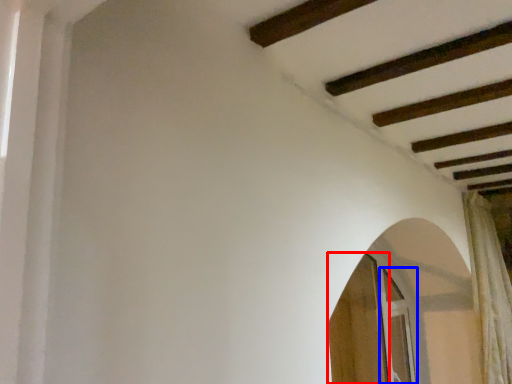
Question: Which object appears closest to the camera in this image, screen door (highlighted by a red box) or screen door (highlighted by a blue box)?

Choices:
 (A) screen door
 (B) screen door

Answer: (A)